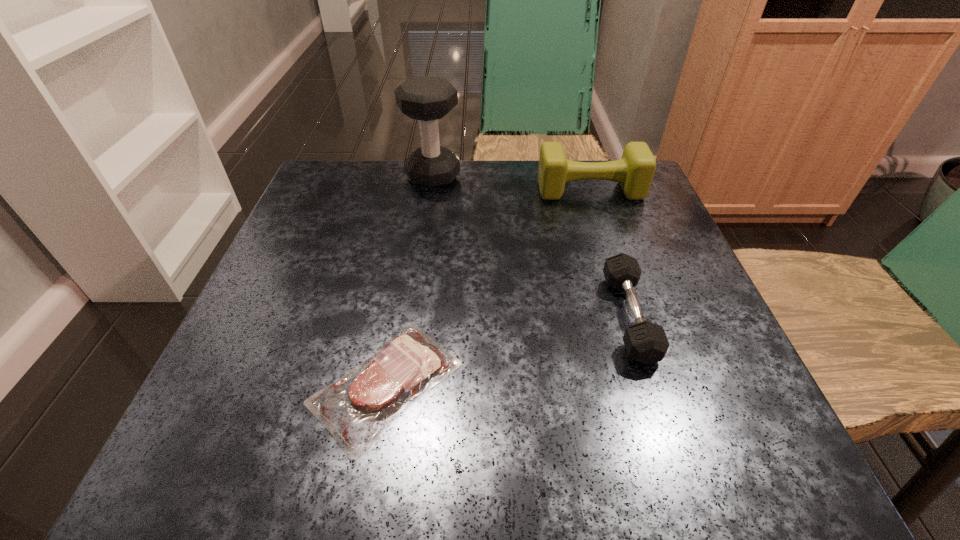
Where is `vacant point located between the steak and the second shortest object`? vacant point located between the steak and the second shortest object is located at coordinates (508, 349).

Point out which object is positioned as the second nearest to the shortest object. Please provide its 2D coordinates. Your answer should be formatted as a tuple, i.e. [(x, y)], where the tuple contains the x and y coordinates of a point satisfying the conditions above.

[(634, 171)]

The height and width of the screenshot is (540, 960). In order to click on the second closest object to the tallest object in this screenshot , I will do `click(646, 342)`.

Where is `dumbbell identified as the closest to the third shortest object`? This screenshot has height=540, width=960. dumbbell identified as the closest to the third shortest object is located at coordinates (427, 98).

Where is `the second closest dumbbell to the tallest dumbbell`? This screenshot has height=540, width=960. the second closest dumbbell to the tallest dumbbell is located at coordinates (646, 342).

At what (x,y) coordinates should I click in order to perform the action: click on free space that satisfies the following two spatial constraints: 1. on the front side of the tallest dumbbell; 2. on the left side of the second shortest object. Please return your answer as a coordinate pair (x, y). This screenshot has width=960, height=540. Looking at the image, I should click on (413, 316).

You are a GUI agent. You are given a task and a screenshot of the screen. Output one action in this format:
    pyautogui.click(x=<x>, y=<y>)
    Task: Click on the vacant area in the image that satisfies the following two spatial constraints: 1. on the back side of the shortest object; 2. on the left side of the tallest dumbbell
    The width and height of the screenshot is (960, 540).
    Given the screenshot: What is the action you would take?
    pyautogui.click(x=422, y=176)

Locate an element on the screen. vacant space that satisfies the following two spatial constraints: 1. on the back side of the second tallest object; 2. on the left side of the shortest object is located at coordinates (420, 190).